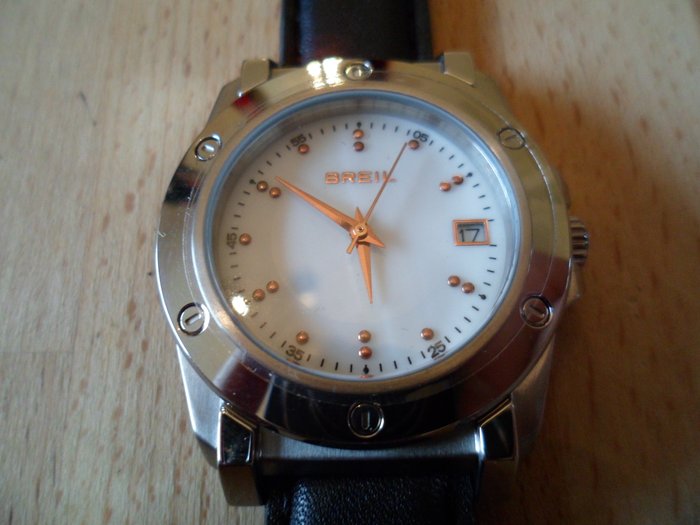
Image resolution: width=700 pixels, height=525 pixels. I want to click on screws, so click(367, 418), click(538, 314), click(507, 135), click(362, 65), click(211, 146), click(204, 323).